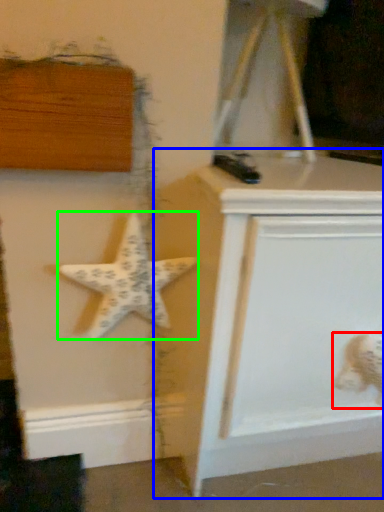
Question: Based on their relative distances, which object is nearer to toy (highlighted by a red box)? Choose from vanity (highlighted by a blue box) and starfish (highlighted by a green box).

Choices:
 (A) vanity
 (B) starfish

Answer: (A)